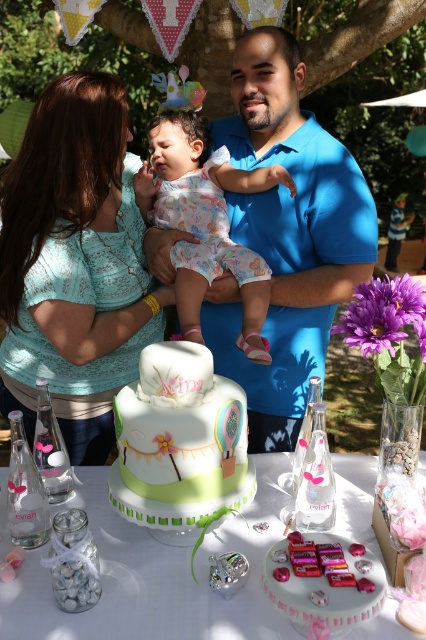
You are a photographer at the party and need to position a camera to capture both the pastel floral onesie at center and the shiny pink cake at center in the same frame. Which object should you adjust your camera angle to focus on first to ensure both are in the frame?

The pastel floral onesie at center is wider than the shiny pink cake at center, so you should adjust your camera angle to focus on the pastel floral onesie at center first to ensure both fit in the frame.

You are a photographer at the baby shower. You need to take a photo of the white frosted cake at center and the pastel floral onesie at center. Which object is closer to the camera?

The pastel floral onesie at center is closer to the camera than the white frosted cake at center because it is positioned over it.